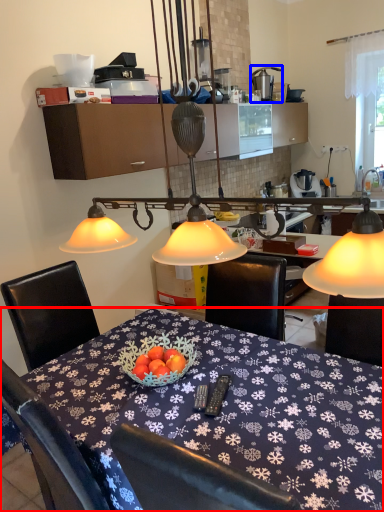
Question: Among these objects, which one is nearest to the camera, desk (highlighted by a red box) or tableware (highlighted by a blue box)?

Choices:
 (A) desk
 (B) tableware

Answer: (A)